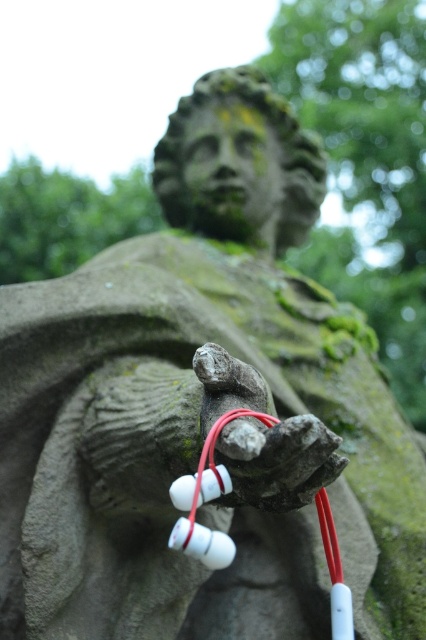
Who is positioned more to the left, smooth stone hand at center or white plastic earphones at center?

white plastic earphones at center is more to the left.

Between smooth stone hand at center and white plastic earphones at center, which one is positioned lower?

white plastic earphones at center

Between point (331, 481) and point (187, 496), which one is positioned behind?

The point (331, 481) is behind.

At what (x,y) coordinates should I click in order to perform the action: click on smooth stone hand at center. Please return your answer as a coordinate pair (x, y). The image size is (426, 640). Looking at the image, I should click on (281, 464).